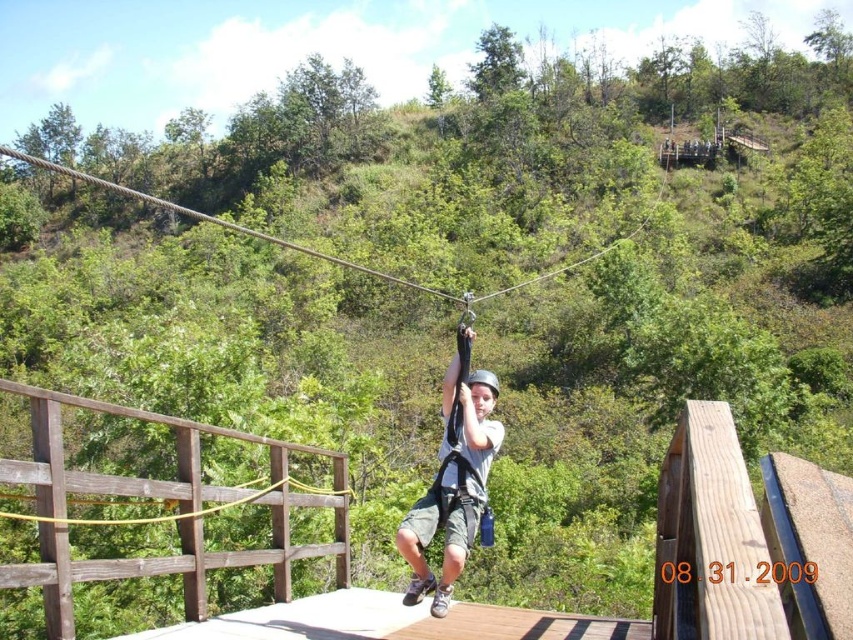
You are a safety inspector checking the zip line setup. You notice the matte black harness at center and the brown rope at upper center. According to safety protocols, the harness should be positioned to the left of the rope. Is the current setup compliant with safety standards?

The matte black harness at center is to the right of the brown rope at upper center, which means it is not positioned to the left as required by safety protocols. Therefore, the setup does not comply with safety standards.

You are standing at the wooden platform at the starting point and want to reach the zip line anchor point located at point (105, 182). If your maximum throwing distance is 40 feet, can you throw a rope to the anchor point?

The distance between the wooden platform at the starting point and the anchor point at point (105, 182) is 42.61 feet, which exceeds your maximum throwing distance of 40 feet. Therefore, you cannot throw the rope to the anchor point.

You are a safety inspector checking the zip line setup. You notice the matte black harness at center and the yellow rubber rope at center. According to safety protocols, which object should be in front to ensure visibility of the harness? Please answer based on their current positions.

The matte black harness at center should be in front of the yellow rubber rope at center to ensure visibility, but currently, the yellow rubber rope at center is behind matte black harness at center, so the setup is correct as the harness is in front.